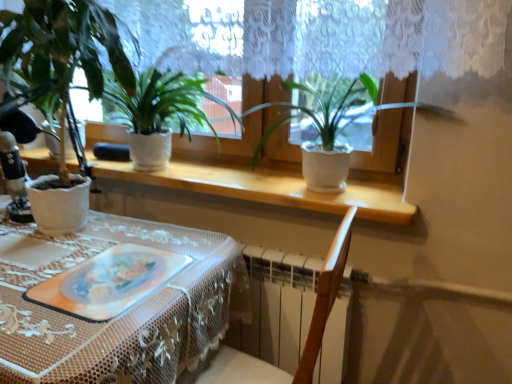
Question: Is white matte pot at center, acting as the 1th houseplant starting from the right, next to white textured pot at left, the 1th houseplant in the left-to-right sequence?

Choices:
 (A) no
 (B) yes

Answer: (A)

Question: Is white matte pot at center, acting as the 1th houseplant starting from the right, far away from white textured pot at left, the 1th houseplant in the left-to-right sequence?

Choices:
 (A) no
 (B) yes

Answer: (A)

Question: Is white textured pot at left, the 1th houseplant in the left-to-right sequence, located within white matte pot at center, the third houseplant positioned from the left?

Choices:
 (A) yes
 (B) no

Answer: (B)

Question: Is white matte pot at center, acting as the 1th houseplant starting from the right, positioned with its back to white textured pot at left, the 1th houseplant in the left-to-right sequence?

Choices:
 (A) yes
 (B) no

Answer: (B)

Question: Is white matte pot at center, the third houseplant positioned from the left, at the left side of white textured pot at left, the 1th houseplant in the left-to-right sequence?

Choices:
 (A) no
 (B) yes

Answer: (A)

Question: Is white matte pot at center, the third houseplant positioned from the left, smaller than white textured pot at left, arranged as the 3th houseplant when viewed from the right?

Choices:
 (A) yes
 (B) no

Answer: (A)

Question: From the image's perspective, would you say white textured pot at center is positioned over matte white pot at center, which is the 2th houseplant from right to left?

Choices:
 (A) yes
 (B) no

Answer: (B)

Question: Considering the relative positions of white textured pot at center and matte white pot at center, which is the 2th houseplant from right to left, in the image provided, is white textured pot at center behind matte white pot at center, which is the 2th houseplant from right to left,?

Choices:
 (A) no
 (B) yes

Answer: (A)

Question: Can you confirm if white textured pot at center is shorter than matte white pot at center, which is the 2th houseplant from right to left?

Choices:
 (A) no
 (B) yes

Answer: (B)

Question: Can you confirm if white textured pot at center is smaller than matte white pot at center, placed as the second houseplant when sorted from left to right?

Choices:
 (A) no
 (B) yes

Answer: (B)

Question: From the image's perspective, is white textured pot at center below matte white pot at center, which is the 2th houseplant from right to left?

Choices:
 (A) no
 (B) yes

Answer: (B)

Question: Does white textured pot at center appear on the right side of matte white pot at center, which is the 2th houseplant from right to left?

Choices:
 (A) yes
 (B) no

Answer: (A)

Question: Are white lace tablecloth at lower left and white matte pot at center, acting as the 1th houseplant starting from the right, making contact?

Choices:
 (A) no
 (B) yes

Answer: (A)